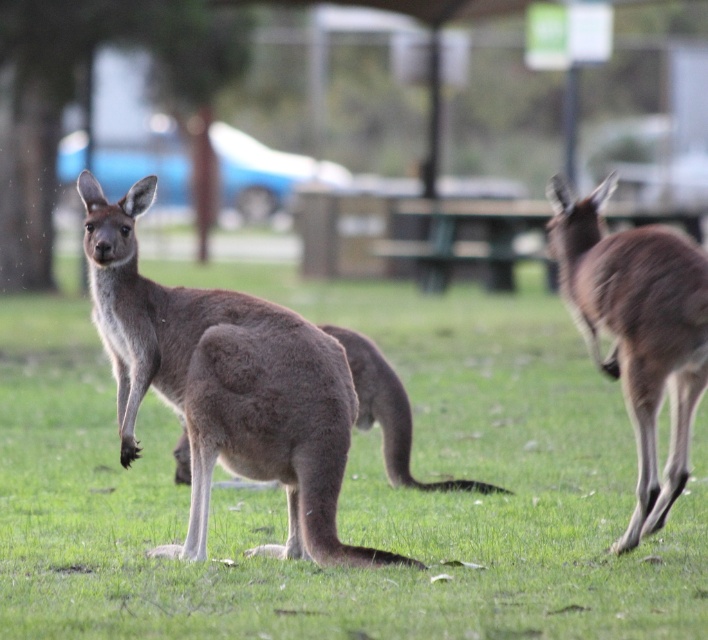
You are a wildlife photographer aiming to capture a photo of both the brown furry kangaroo at center and the brown furry kangaroo at right. Considering their sizes, which kangaroo should you focus on first to ensure they both fit in the frame?

The brown furry kangaroo at center is wider than the brown furry kangaroo at right. To ensure both fit in the frame, focus on the brown furry kangaroo at center first, as it is larger and requires more space.

You are standing in the park and see the brown furry kangaroo at center. Where is it positioned relative to your viewpoint?

The brown furry kangaroo at center is located at point 0.761 meters to the right and 0.490 meters forward from your viewpoint.